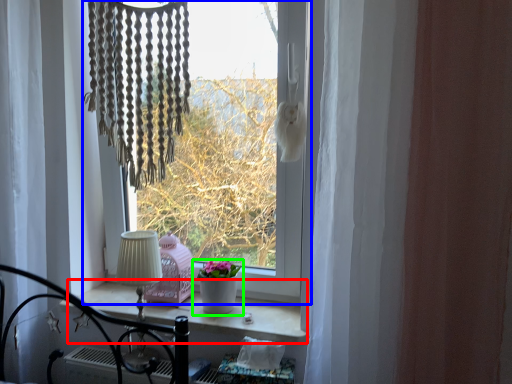
Question: Estimate the real-world distances between objects in this image. Which object is farther from window sill (highlighted by a red box), window (highlighted by a blue box) or houseplant (highlighted by a green box)?

Choices:
 (A) window
 (B) houseplant

Answer: (A)